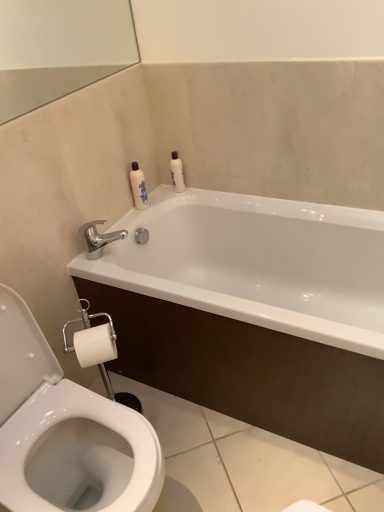
Image resolution: width=384 pixels, height=512 pixels. What are the coordinates of `vacant area to the right of white glossy bottle at upper center, the 1th toiletry positioned from the left` in the screenshot? It's located at tap(187, 194).